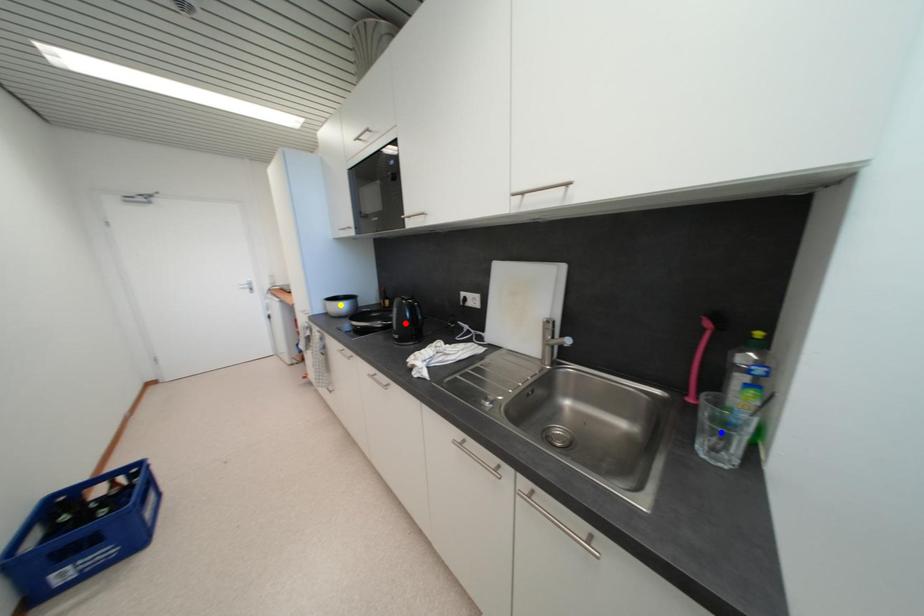
Order these from nearest to farthest:
blue point, yellow point, red point

blue point
red point
yellow point